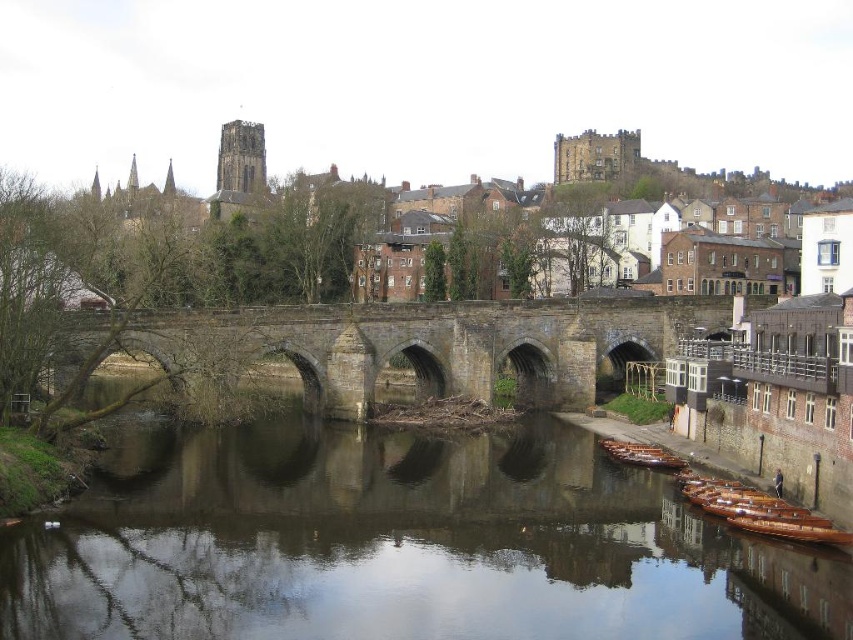
Does point (329, 320) come behind point (827, 531)?

That is True.

Can you confirm if stone arch bridge at center is bigger than wooden polished boats at lower right?

Indeed, stone arch bridge at center has a larger size compared to wooden polished boats at lower right.

Where is `stone arch bridge at center`? stone arch bridge at center is located at coordinates (401, 344).

Based on the photo, does brown stone bridge at center have a larger size compared to stone arch bridge at center?

Correct, brown stone bridge at center is larger in size than stone arch bridge at center.

Who is positioned more to the right, brown stone bridge at center or stone arch bridge at center?

stone arch bridge at center

Which is behind, point (570, 188) or point (218, 340)?

Positioned behind is point (570, 188).

Identify the location of brown stone bridge at center. This screenshot has height=640, width=853. (430, 230).

Is smooth brown water at center positioned before wooden polished boats at lower right?

That is True.

Does smooth brown water at center appear under wooden polished boats at lower right?

Indeed, smooth brown water at center is positioned under wooden polished boats at lower right.

Where is `smooth brown water at center`? The image size is (853, 640). smooth brown water at center is located at coordinates (396, 544).

The height and width of the screenshot is (640, 853). What are the coordinates of `smooth brown water at center` in the screenshot? It's located at (396, 544).